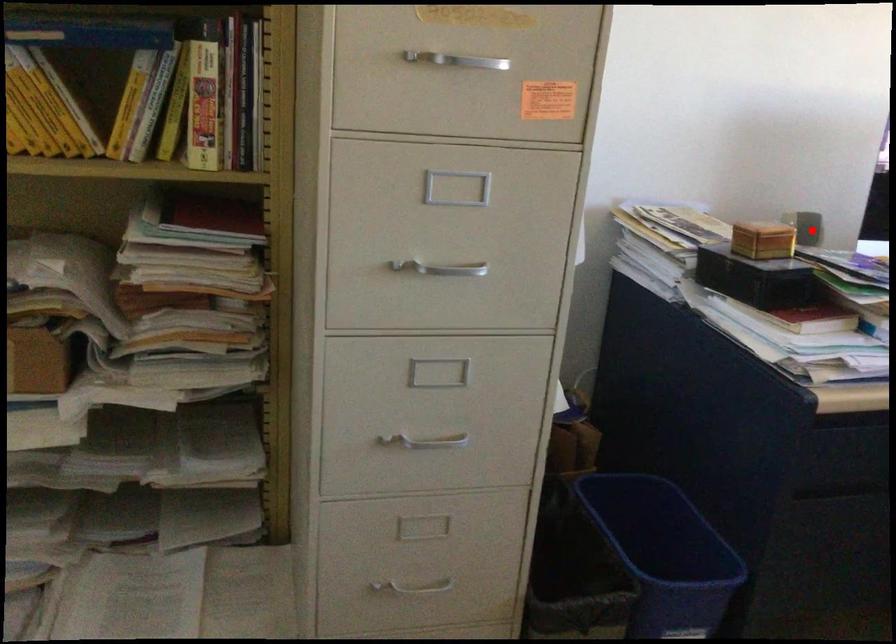
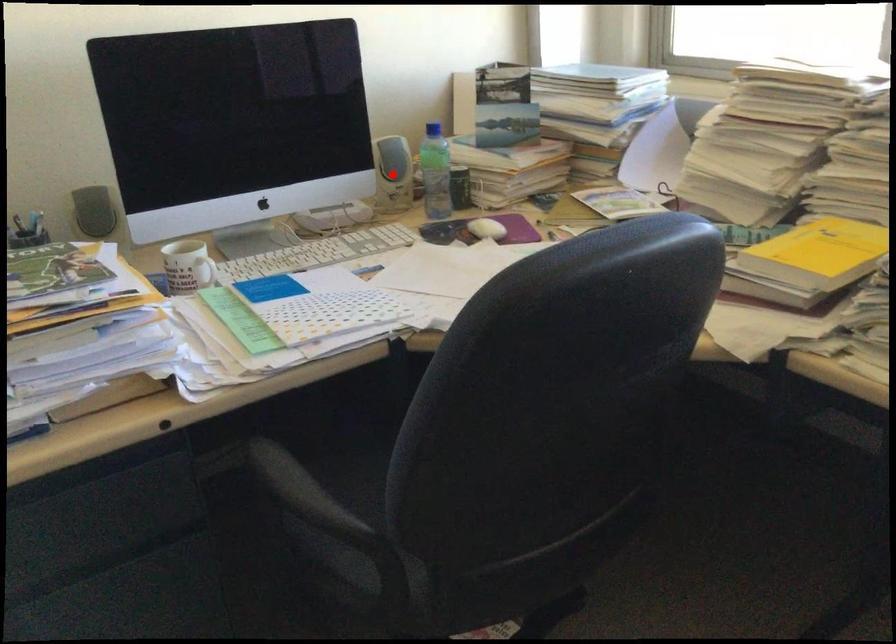
I am providing you with two images of the same scene from different viewpoints. A red point is marked on the first image and another point is marked on the second image. Is the red point in image1 aligned with the point shown in image2?

No